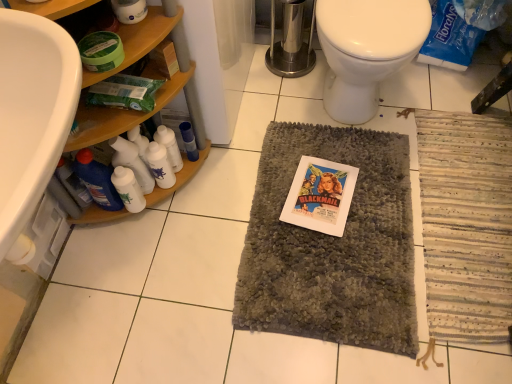
This screenshot has height=384, width=512. I want to click on vacant area that lies between blue glossy bottle at lower left, which is the 5th bottle from right to left, and striped fabric bath mat at lower right, so click(290, 228).